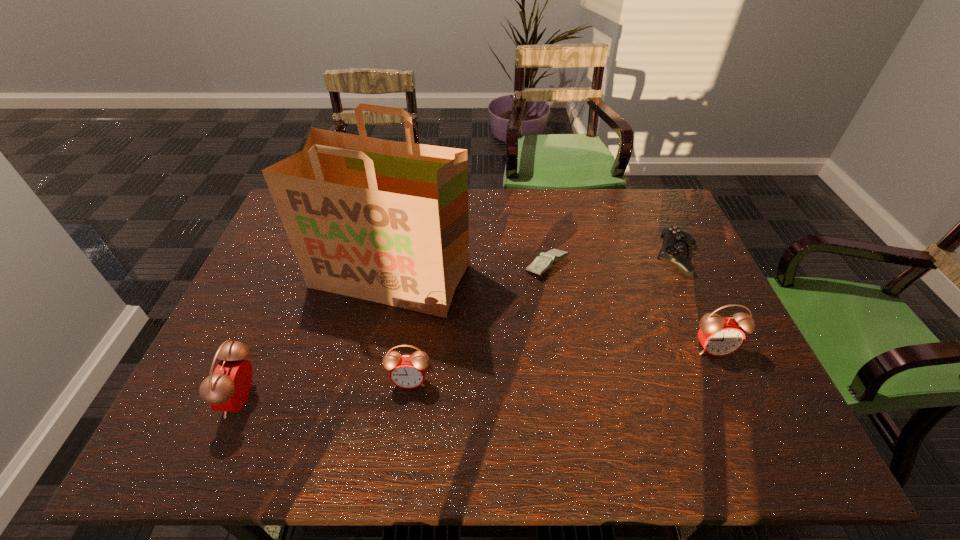
Locate an element on the screen. This screenshot has width=960, height=540. vacant space that is in between the leftmost alarm clock and the fourth object from left to right is located at coordinates (396, 332).

You are a GUI agent. You are given a task and a screenshot of the screen. Output one action in this format:
    pyautogui.click(x=<x>, y=<y>)
    Task: Click on the unoccupied position between the rightmost alarm clock and the leftmost object
    The image size is (960, 540).
    Given the screenshot: What is the action you would take?
    pyautogui.click(x=478, y=373)

Where is `free space between the third object from right to left and the farthest alarm clock`? Image resolution: width=960 pixels, height=540 pixels. free space between the third object from right to left and the farthest alarm clock is located at coordinates click(x=630, y=307).

The height and width of the screenshot is (540, 960). Identify the location of free space that is in between the fourth object from left to right and the shortest alarm clock. (479, 323).

Locate an element on the screen. The width and height of the screenshot is (960, 540). the fourth closest object relative to the leftmost alarm clock is located at coordinates (719, 336).

Find the location of a particular element. The width and height of the screenshot is (960, 540). object that is the third closest to the third shortest object is located at coordinates (545, 261).

At what (x,y) coordinates should I click in order to perform the action: click on alarm clock that stands as the closest to the diary. Please return your answer as a coordinate pair (x, y). This screenshot has height=540, width=960. Looking at the image, I should click on (719, 336).

Where is `alarm clock that stands as the second closest to the fifth tallest object`? alarm clock that stands as the second closest to the fifth tallest object is located at coordinates (406, 371).

Find the location of a particular element. free space that satisfies the following two spatial constraints: 1. on the back side of the tallest object; 2. on the left side of the diary is located at coordinates (393, 265).

The image size is (960, 540). I want to click on vacant point that satisfies the following two spatial constraints: 1. on the clock face of the shortest alarm clock; 2. on the clock face of the leftmost alarm clock, so [x=408, y=399].